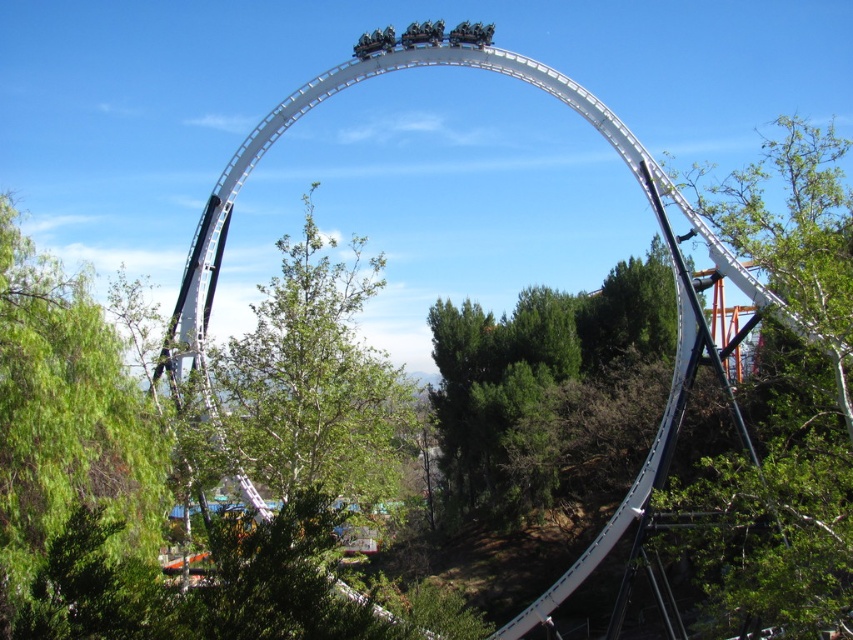
Question: Which point is farther to the camera?

Choices:
 (A) (299, 364)
 (B) (810, 529)
 (C) (659, 301)
 (D) (32, 444)

Answer: (C)

Question: Estimate the real-world distances between objects in this image. Which object is farther from the green leafy tree at right?

Choices:
 (A) green leafy tree at center
 (B) green leafy tree at left

Answer: (B)

Question: Among these objects, which one is nearest to the camera?

Choices:
 (A) green leafy tree at right
 (B) green textured tree at center

Answer: (A)

Question: Can you confirm if green leafy tree at right is thinner than green leafy tree at center?

Choices:
 (A) yes
 (B) no

Answer: (B)

Question: Is green leafy tree at right positioned at the back of green textured tree at center?

Choices:
 (A) yes
 (B) no

Answer: (B)

Question: Does green textured tree at center appear on the left side of green leafy tree at left?

Choices:
 (A) yes
 (B) no

Answer: (B)